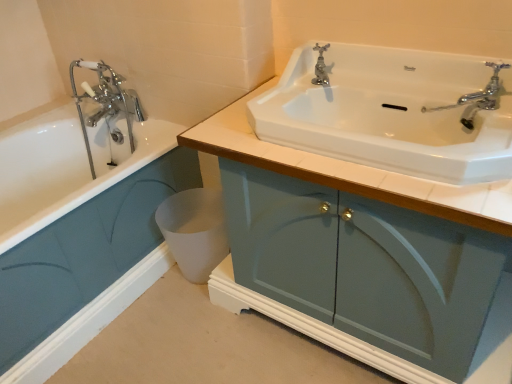
At what (x,y) coordinates should I click in order to perform the action: click on vacant area that is in front of polished chrome faucet at upper center. Please return your answer as a coordinate pair (x, y). The image size is (512, 384). Looking at the image, I should click on (328, 97).